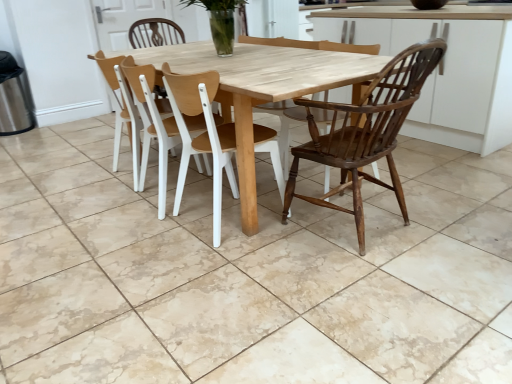
Locate an element on the screen. The height and width of the screenshot is (384, 512). vacant space underneath dark brown wood chair at right, the first chair in the right-to-left sequence (from a real-world perspective) is located at coordinates (372, 237).